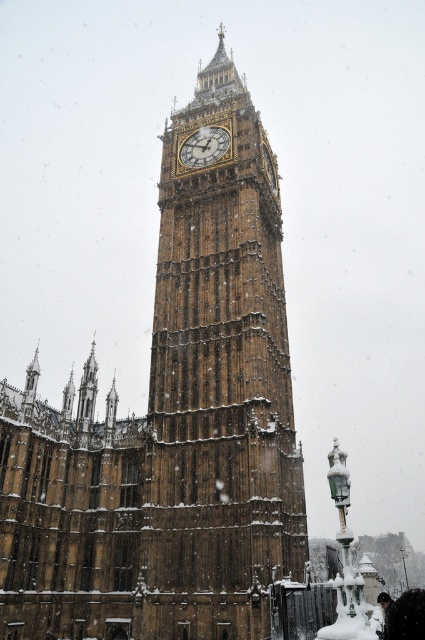
Looking at this image, who is positioned more to the right, brown stone clock tower at center or gold textured clock at center?

gold textured clock at center is more to the right.

Can you confirm if brown stone clock tower at center is positioned to the right of gold textured clock at center?

In fact, brown stone clock tower at center is to the left of gold textured clock at center.

Which is in front, point (172, 120) or point (204, 154)?

Positioned in front is point (204, 154).

Identify the location of brown stone clock tower at center. This screenshot has width=425, height=640. (218, 387).